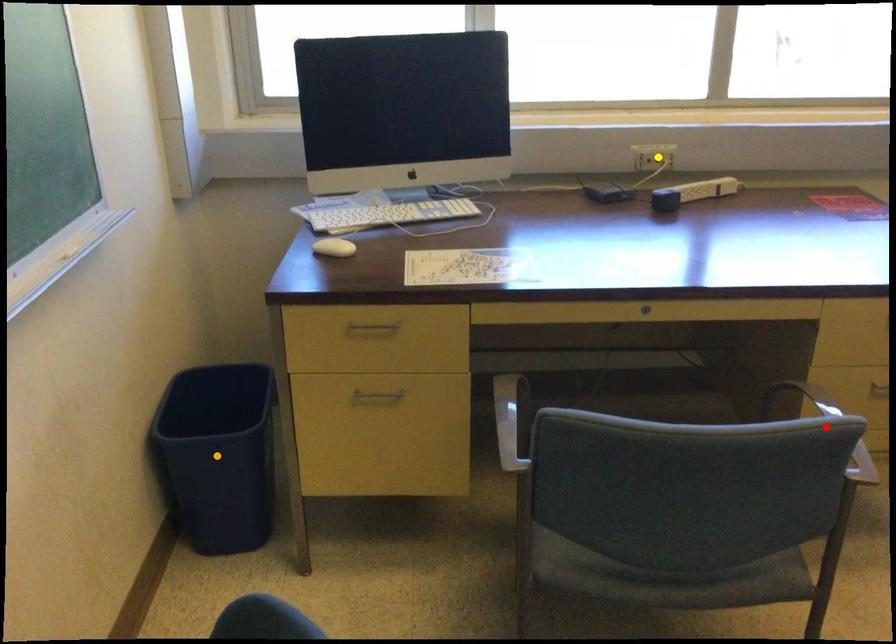
Order these from nearest to farthest:
A) yellow point
B) orange point
C) red point

red point
orange point
yellow point